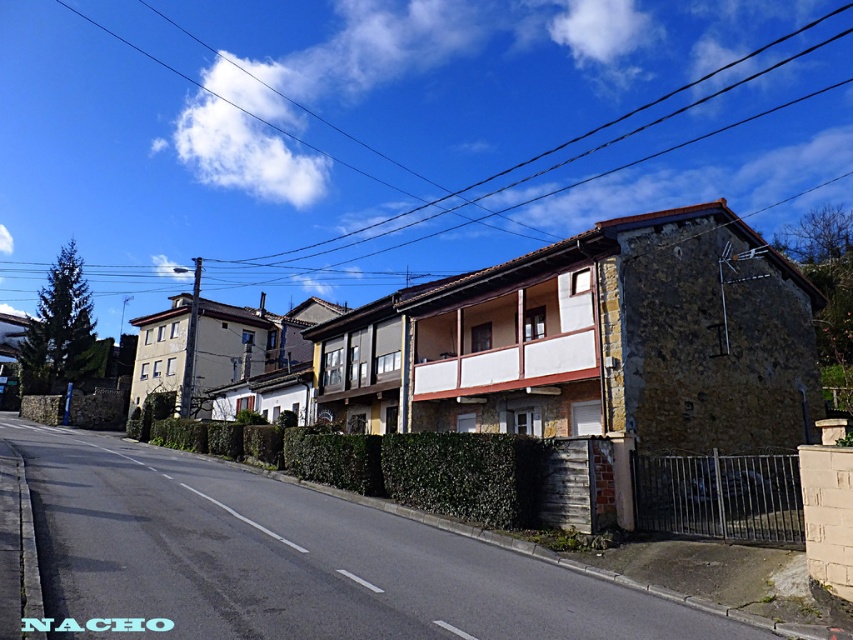
Question: Which of the following is the farthest from the observer?

Choices:
 (A) brown wooden power line at upper center
 (B) green leafy hedge at center

Answer: (A)

Question: Is brown wooden power line at upper center wider than green leafy hedge at center?

Choices:
 (A) no
 (B) yes

Answer: (B)

Question: From the image, what is the correct spatial relationship of brown wooden power line at upper center in relation to green leafy hedge at center?

Choices:
 (A) below
 (B) above

Answer: (B)

Question: Which object appears closest to the camera in this image?

Choices:
 (A) green leafy hedge at center
 (B) brown wooden power line at upper center

Answer: (A)

Question: Is brown wooden power line at upper center positioned in front of green leafy hedge at center?

Choices:
 (A) yes
 (B) no

Answer: (B)